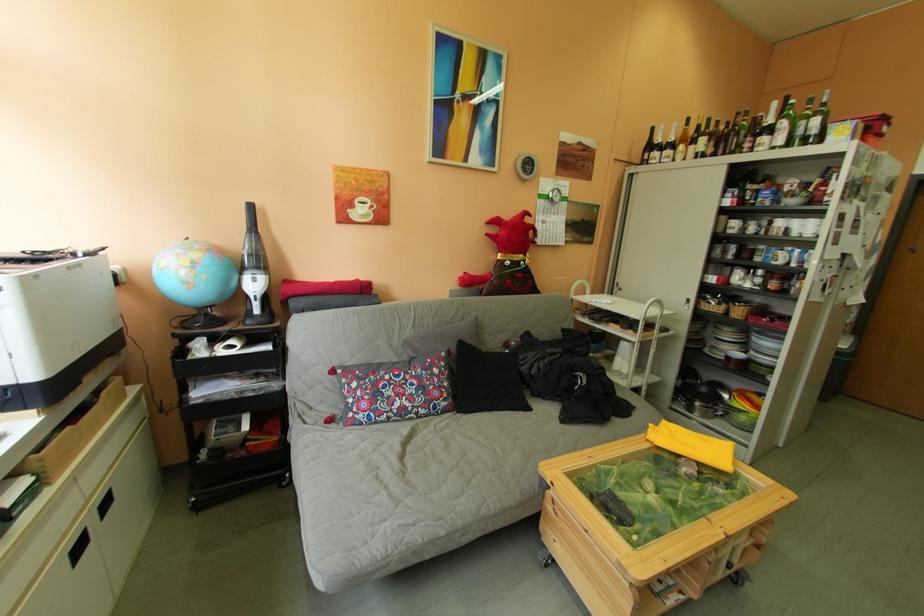
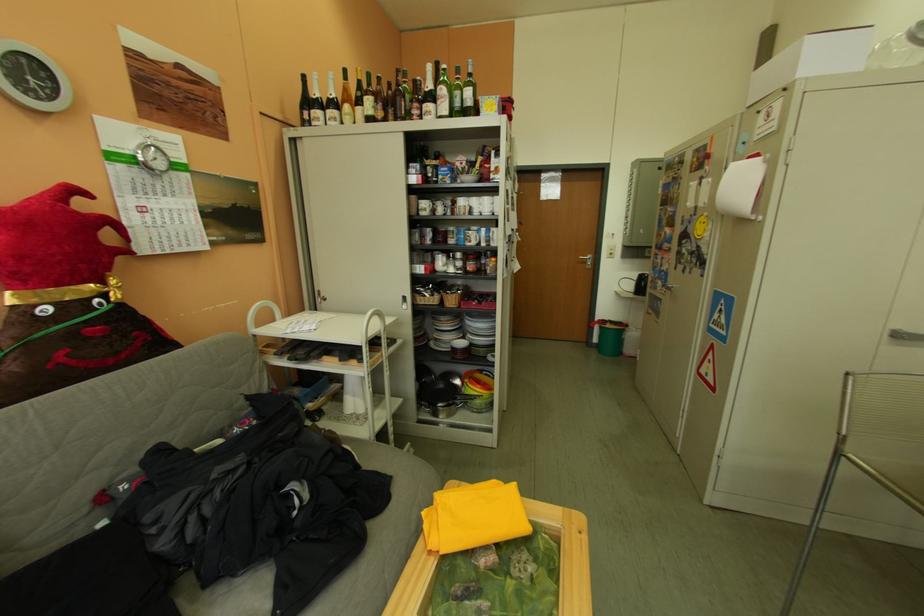
Where in the second image is the point corresponding to point (695, 150) from the first image?

(360, 111)